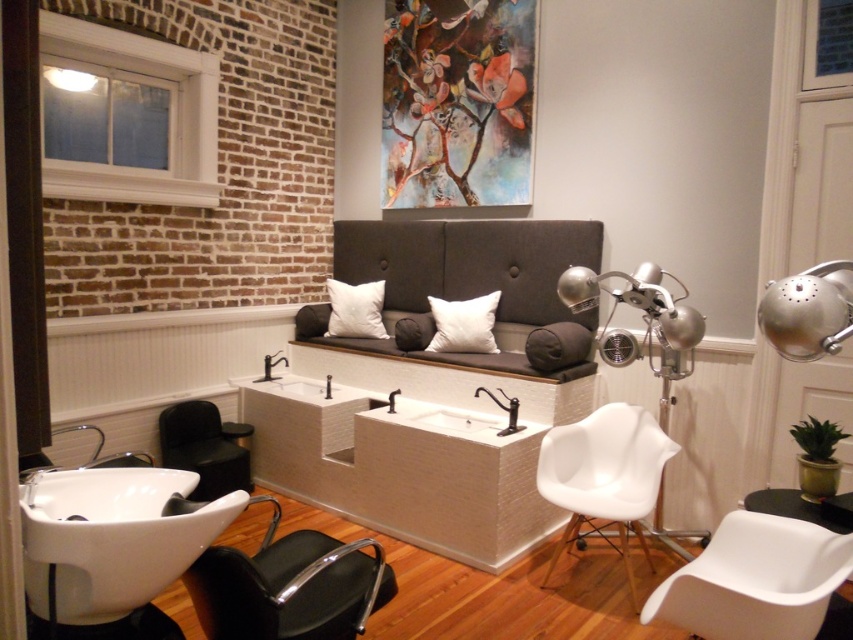
You are a customer entering the salon and want to sit in the most spacious seating option available. Which one should you choose between the dark gray fabric couch at center and the black leather swivel chair at lower center?

The dark gray fabric couch at center is bigger than the black leather swivel chair at lower center, so you should choose the dark gray fabric couch at center for a more spacious seating option.

You are standing in the hair salon and want to determine the relative positions of two points marked in the image. Which point is closer to you, point (822, 337) or point (352, 321)?

Point (822, 337) is closer to the viewer than point (352, 321).

Looking at this image, you are standing in the hair salon and want to take a photo of the point at coordinates point (x=374, y=266). If your camera has a focal length of 50mm and you are currently 4.55 meters away from the point, will you need to move closer or farther to ensure the point fills the frame properly?

The point (x=374, y=266) is 4.55 meters from the camera. To fill the frame properly, you would need to move closer if the subject is smaller than the frame requires or farther if it is larger, but since the point is a single coordinate, adjusting distance may not significantly affect framing. Consider using zoom instead.